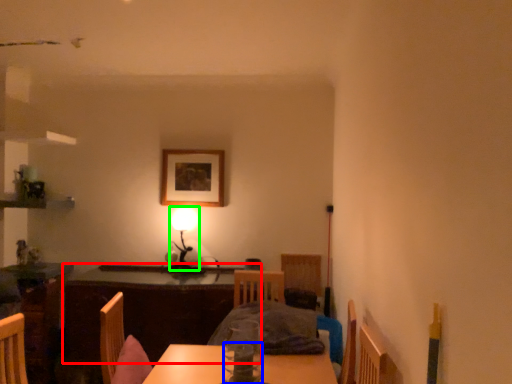
Question: Considering the real-world distances, which object is closest to table (highlighted by a red box)? tableware (highlighted by a blue box) or table lamp (highlighted by a green box).

Choices:
 (A) tableware
 (B) table lamp

Answer: (B)